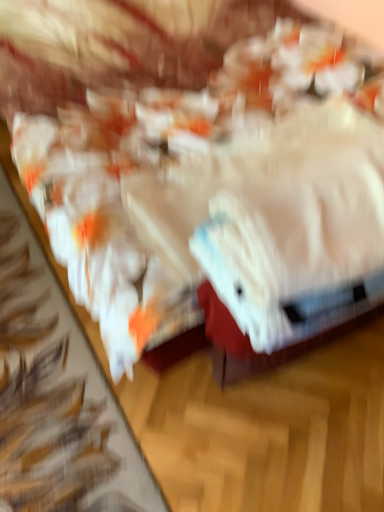
Question: Is the surface of white glossy plastic bag at center in direct contact with white fluffy towel at center?

Choices:
 (A) no
 (B) yes

Answer: (A)

Question: Is white glossy plastic bag at center outside white fluffy towel at center?

Choices:
 (A) no
 (B) yes

Answer: (B)

Question: Is white glossy plastic bag at center bigger than white fluffy towel at center?

Choices:
 (A) no
 (B) yes

Answer: (B)

Question: Is the depth of white glossy plastic bag at center greater than that of white fluffy towel at center?

Choices:
 (A) no
 (B) yes

Answer: (A)

Question: From the image's perspective, is white glossy plastic bag at center over white fluffy towel at center?

Choices:
 (A) yes
 (B) no

Answer: (A)

Question: Can you confirm if white glossy plastic bag at center is positioned to the right of white fluffy towel at center?

Choices:
 (A) yes
 (B) no

Answer: (B)

Question: Can you confirm if white fluffy towel at center is taller than white glossy plastic bag at center?

Choices:
 (A) no
 (B) yes

Answer: (A)

Question: Considering the relative positions of white fluffy towel at center and white glossy plastic bag at center in the image provided, is white fluffy towel at center to the left of white glossy plastic bag at center from the viewer's perspective?

Choices:
 (A) yes
 (B) no

Answer: (B)

Question: Are white fluffy towel at center and white glossy plastic bag at center making contact?

Choices:
 (A) no
 (B) yes

Answer: (A)

Question: Is white fluffy towel at center wider than white glossy plastic bag at center?

Choices:
 (A) yes
 (B) no

Answer: (B)

Question: Does white fluffy towel at center contain white glossy plastic bag at center?

Choices:
 (A) yes
 (B) no

Answer: (B)

Question: Is white fluffy towel at center closer to the viewer compared to white glossy plastic bag at center?

Choices:
 (A) yes
 (B) no

Answer: (B)

Question: From a real-world perspective, is white glossy plastic bag at center physically located above or below white fluffy towel at center?

Choices:
 (A) below
 (B) above

Answer: (A)